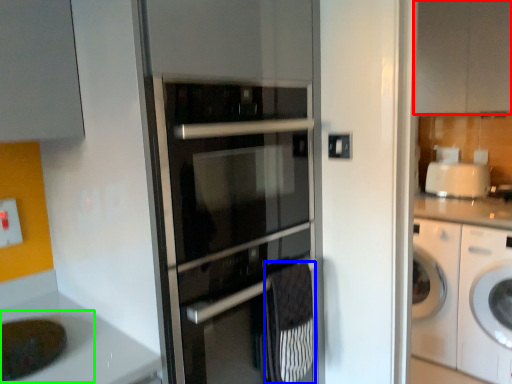
Question: Which object is positioned farthest from cabinetry (highlighted by a red box)? Select from material (highlighted by a blue box) and sink (highlighted by a green box).

Choices:
 (A) material
 (B) sink

Answer: (B)